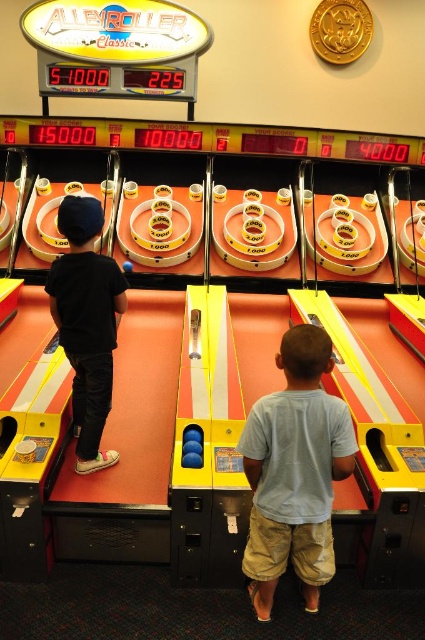
You are a game designer analyzing the layout of the Alley Roller Classic game. You need to determine which of the two points, point (288, 556) or point (81, 403), is positioned closer to the player when they stand at the starting line. Which point is closer?

Point (288, 556) is closer to the viewer than point (81, 403), so the point closer to the player at the starting line is point (288, 556).

You are a game developer analyzing the game setup of Alley Roller Classic. You notice a point at coordinates (294, 472). Based on the scene description, where is this point located?

The point at coordinates (294, 472) is located on the light blue cotton shirt at center.

You are a game attendant at the arcade and need to direct the next player to the starting position. Which shirt is positioned to the right of the other between the light blue cotton shirt at center and the black matte shirt at left?

The light blue cotton shirt at center is positioned to the right of the black matte shirt at left.